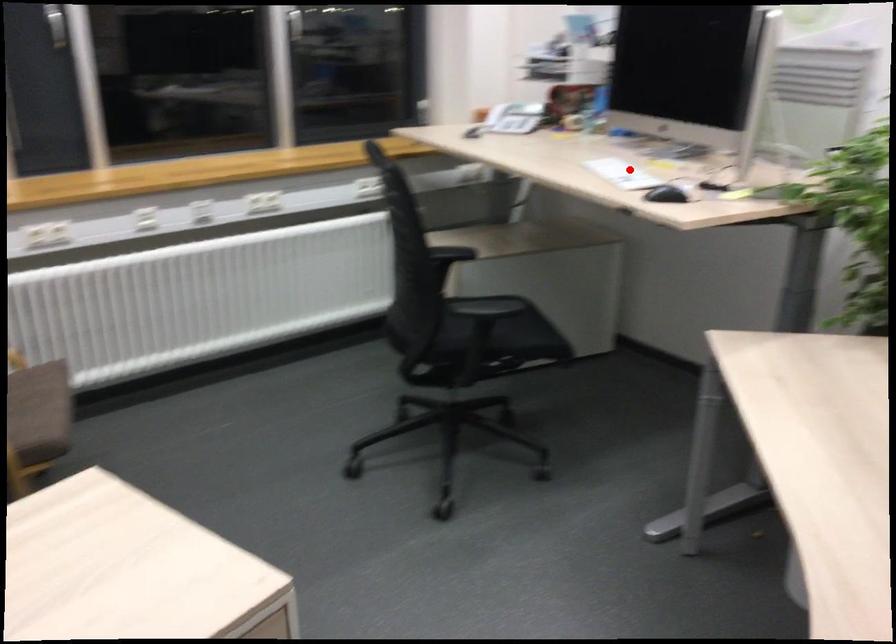
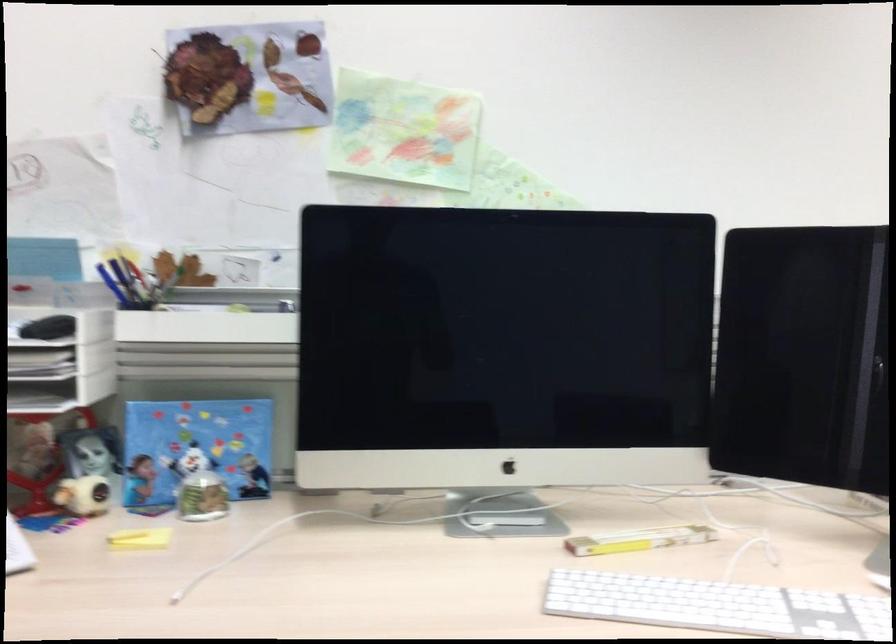
The point at the highlighted location is marked in the first image. Where is the corresponding point in the second image?

(717, 605)